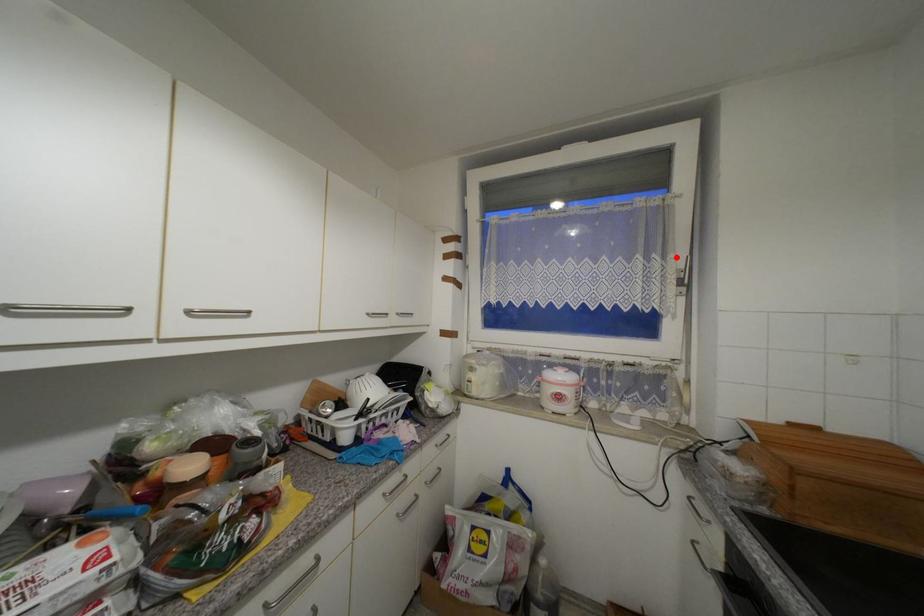
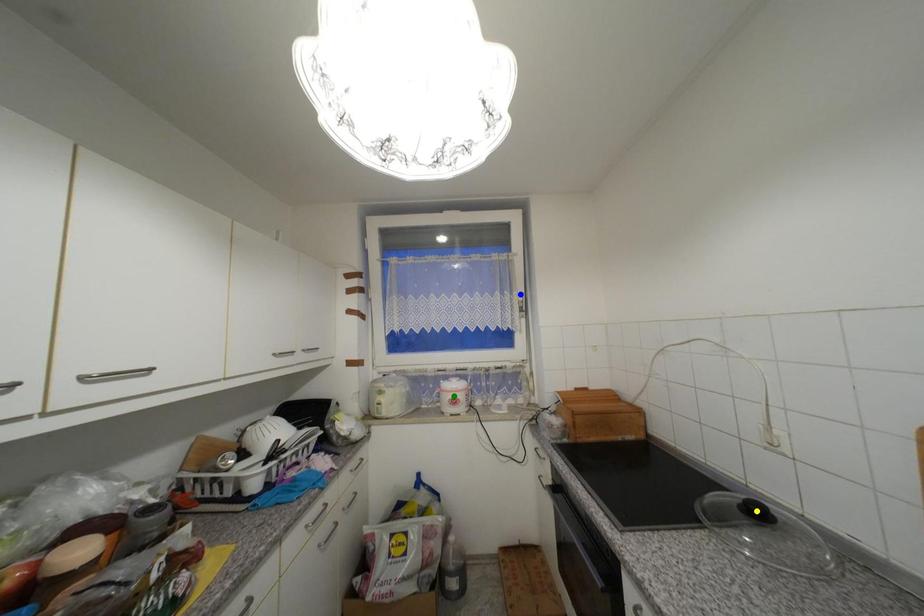
Question: I am providing you with two images of the same scene from different viewpoints. A red point is marked on the first image. You are given multiple points on the second image. Which point in image 2 is actually the same real-world point as the red point in image 1?

Choices:
 (A) blue point
 (B) yellow point
 (C) green point

Answer: (A)